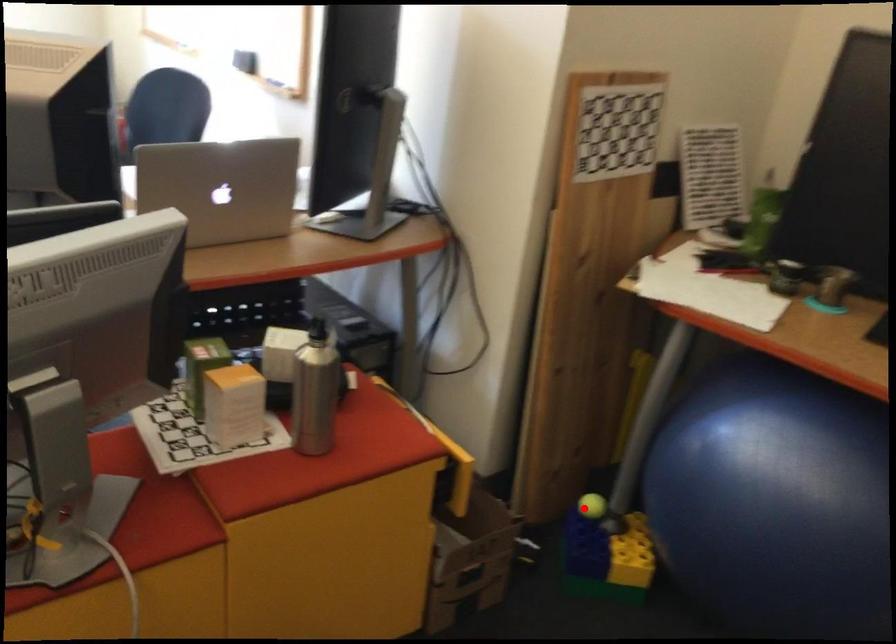
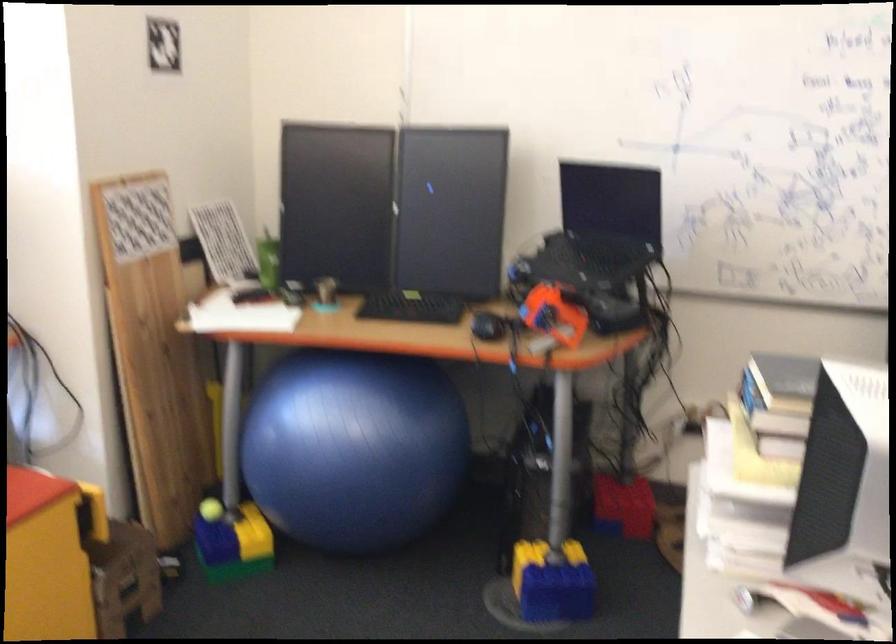
Question: I am providing you with two images of the same scene from different viewpoints. A red point is marked on the first image. Can you still see the location of the red point in image 2?

Choices:
 (A) Yes
 (B) No

Answer: (A)